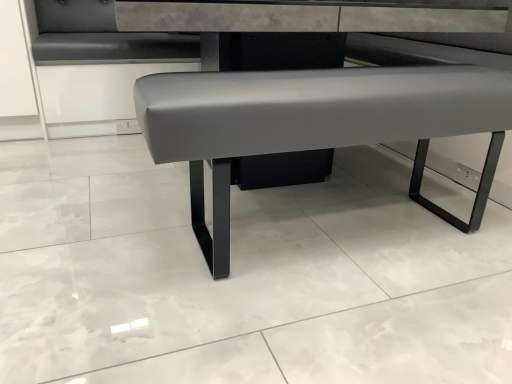
Question: Should I look upward or downward to see matte gray bench at center?

Choices:
 (A) down
 (B) up

Answer: (B)